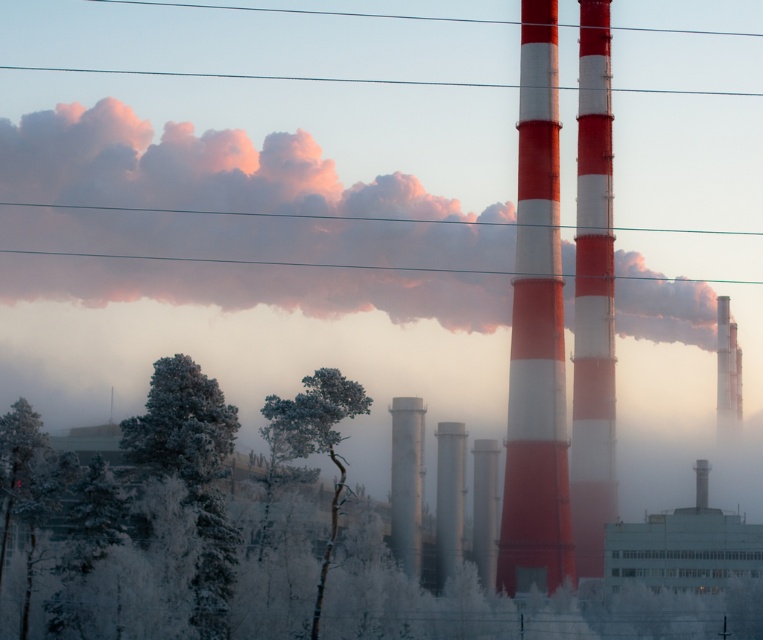
Consider the image. You are standing in the industrial area shown in the image. There are two points marked on the ground, one at coordinates point (446,545) and the other at point (491,540). Which point is closer to your current position?

Point (446,545) is closer to the camera than point (491,540), so it is closer to your current position.

You are standing at the point labeled as point (314, 436) in the image. What object are you standing on?

You are standing on the frosty white tree at center represented by point (314, 436).

You are an observer looking at the industrial scene. You notice the pink cotton cloud at upper center and the satin silver cylinder at center. Which object appears closer to you in the image?

The pink cotton cloud at upper center appears closer to you because it is further to the viewer than the satin silver cylinder at center.